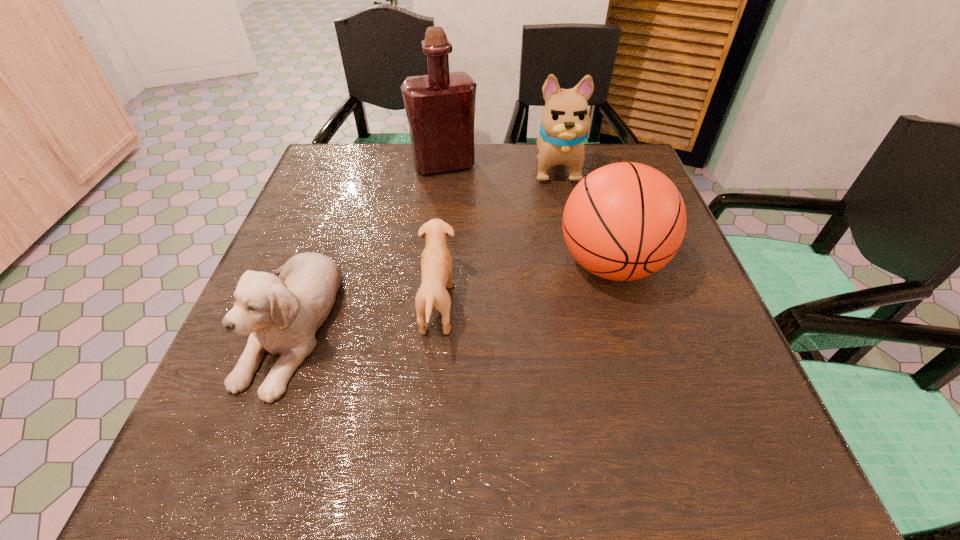
Locate an element on the screen. The image size is (960, 540). free space located on the back of the basketball is located at coordinates (578, 153).

At what (x,y) coordinates should I click in order to perform the action: click on free space located on the front-facing side of the second tallest puppy. Please return your answer as a coordinate pair (x, y). Looking at the image, I should click on (226, 492).

The image size is (960, 540). In order to click on free region located 0.280m on the left side of the shortest puppy in this screenshot , I will do `click(601, 305)`.

The width and height of the screenshot is (960, 540). Identify the location of liquor situated at the far edge. (440, 107).

The image size is (960, 540). What are the coordinates of `puppy at the far edge` in the screenshot? It's located at (565, 118).

At what (x,y) coordinates should I click in order to perform the action: click on object at the left edge. Please return your answer as a coordinate pair (x, y). Image resolution: width=960 pixels, height=540 pixels. Looking at the image, I should click on (282, 314).

Where is `object that is at the right edge`? Image resolution: width=960 pixels, height=540 pixels. object that is at the right edge is located at coordinates [624, 221].

This screenshot has height=540, width=960. I want to click on vacant space at the far edge, so coord(386,192).

In the image, there is a desktop. At what (x,y) coordinates should I click in order to perform the action: click on vacant space at the left edge. Please return your answer as a coordinate pair (x, y). The height and width of the screenshot is (540, 960). Looking at the image, I should click on (240, 346).

Image resolution: width=960 pixels, height=540 pixels. In the image, there is a desktop. What are the coordinates of `vacant space at the right edge` in the screenshot? It's located at (662, 279).